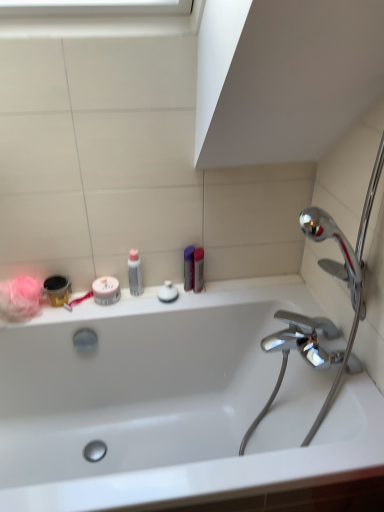
Where is `free space to the left of metallic silver mouthwash at right, marked as the first mouthwash in a right-to-left arrangement`? free space to the left of metallic silver mouthwash at right, marked as the first mouthwash in a right-to-left arrangement is located at coordinates (151, 304).